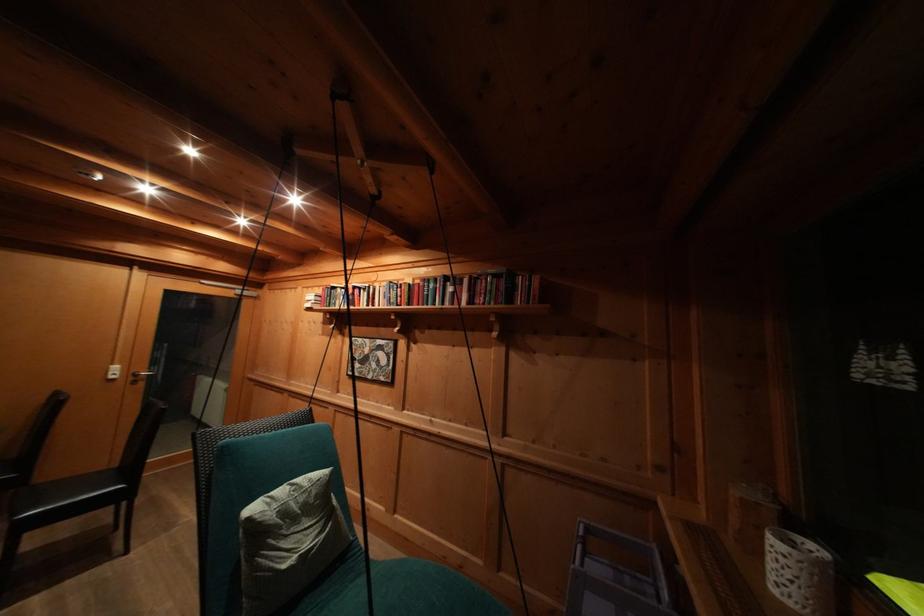
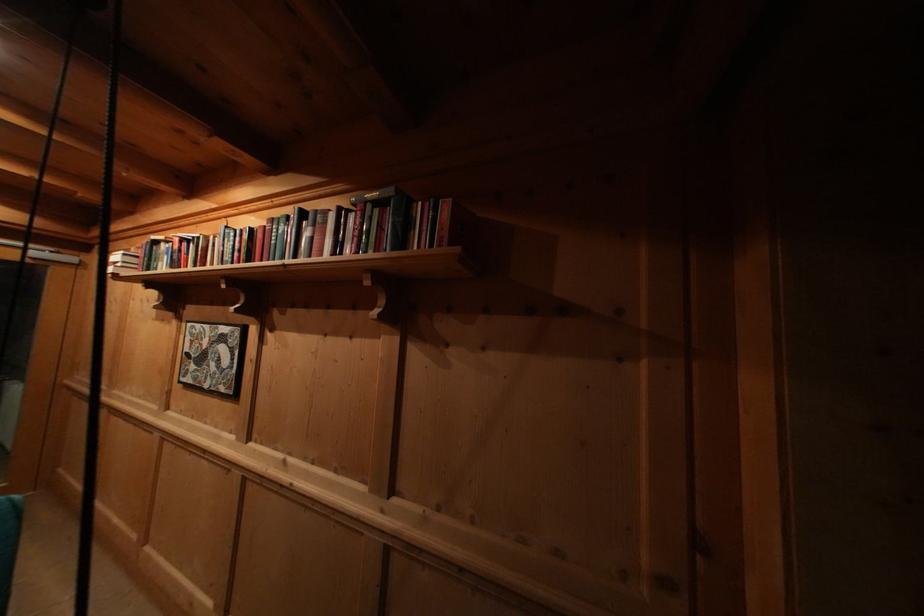
Find the pixel in the second image that matches [360,293] in the first image.

(188, 246)